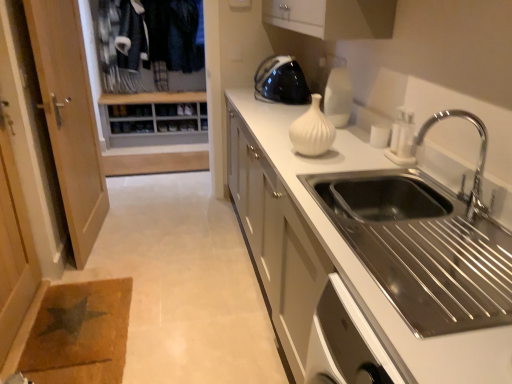
Image resolution: width=512 pixels, height=384 pixels. In order to click on vacant space situated on the left part of white matte vase at center in this screenshot , I will do [x=274, y=152].